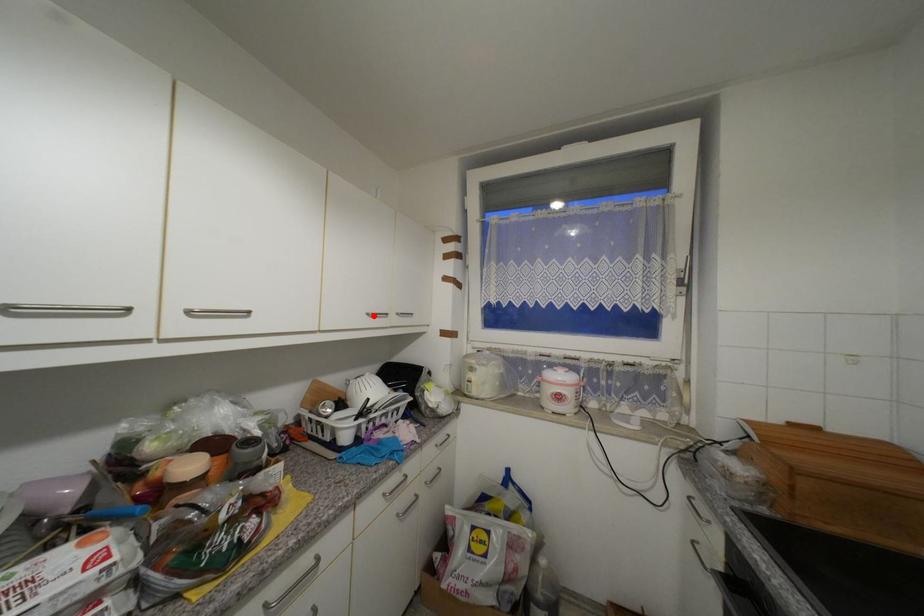
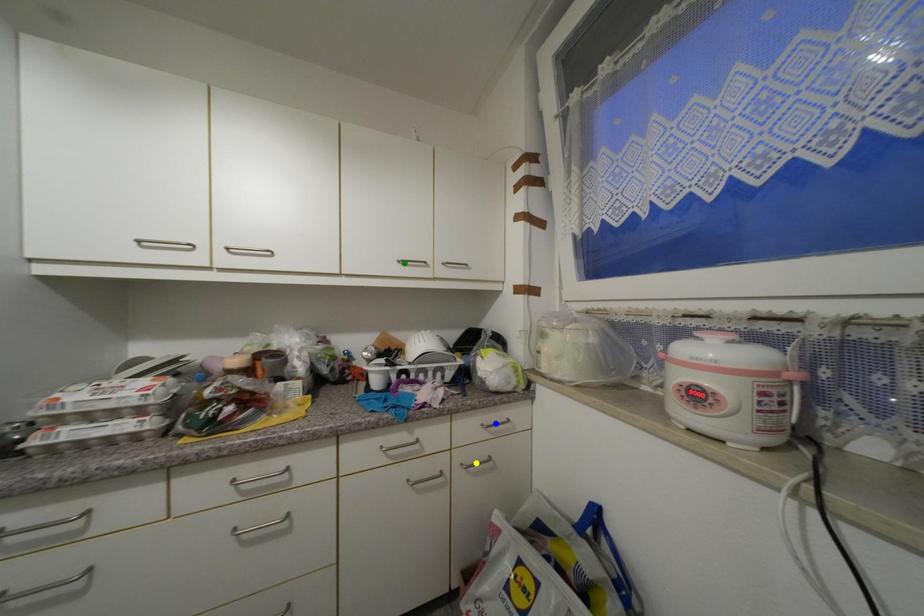
Question: I am providing you with two images of the same scene from different viewpoints. A red point is marked on the first image. You are given multiple points on the second image. Which point in image 2 is actually the same real-world point as the red point in image 1?

Choices:
 (A) yellow point
 (B) blue point
 (C) green point

Answer: (C)